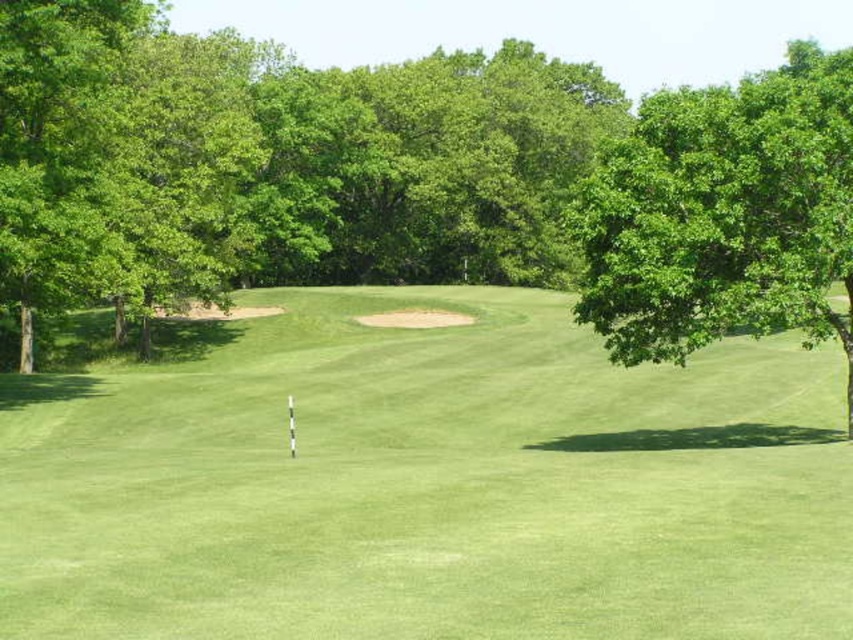
Question: Which of the following is the closest to the observer?

Choices:
 (A) green grassy golf course at center
 (B) green leafy tree at right

Answer: (A)

Question: Which object is closer to the camera taking this photo?

Choices:
 (A) green grassy golf course at center
 (B) green leafy tree at right

Answer: (A)

Question: Can you confirm if green grassy golf course at center is positioned below green leafy tree at right?

Choices:
 (A) yes
 (B) no

Answer: (A)

Question: Observing the image, what is the correct spatial positioning of green grassy golf course at center in reference to green leafy tree at right?

Choices:
 (A) above
 (B) below

Answer: (B)

Question: Is green grassy golf course at center to the right of green leafy tree at right from the viewer's perspective?

Choices:
 (A) yes
 (B) no

Answer: (B)